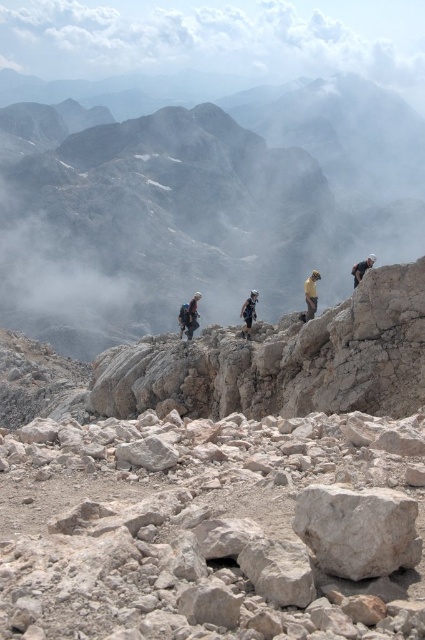
You are planning to set up a tent between the rocky cliff at center and the light brown fabric backpack at center. Based on the scene, can you determine if there is enough space between them to place the tent?

The rocky cliff at center might be wider than the light brown fabric backpack at center, so there might be enough space between them to place the tent.